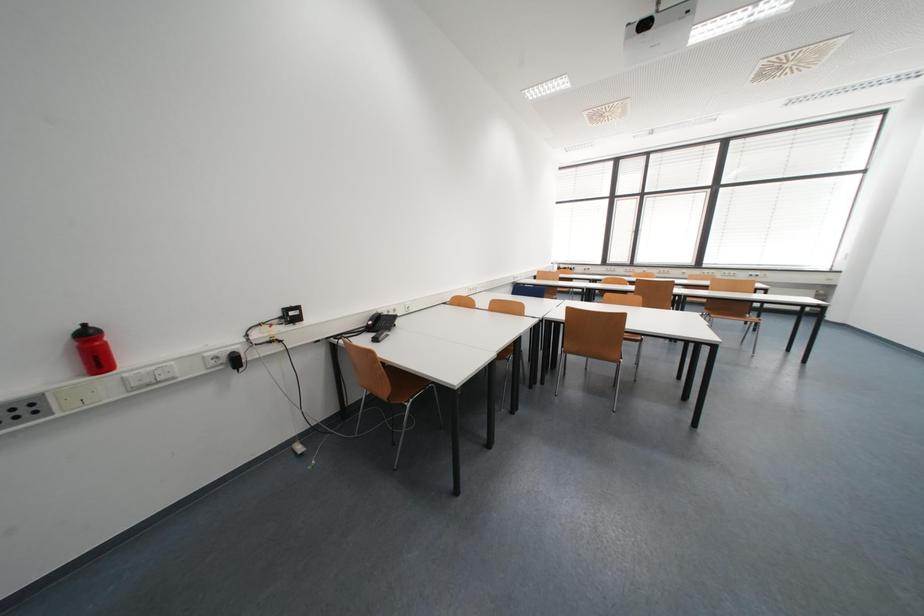
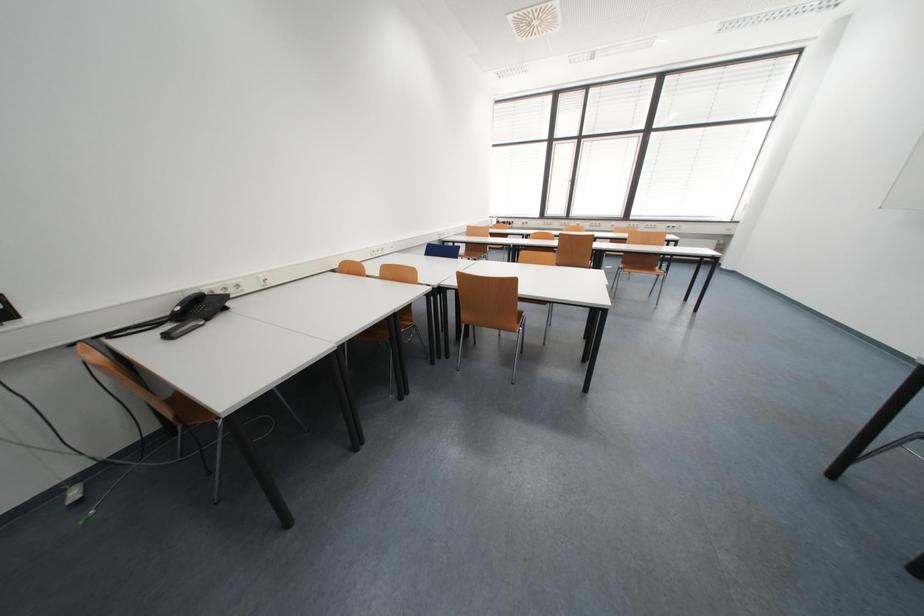
Which direction would the cameraman need to move to produce the second image?

The cameraman moved toward right, forward.